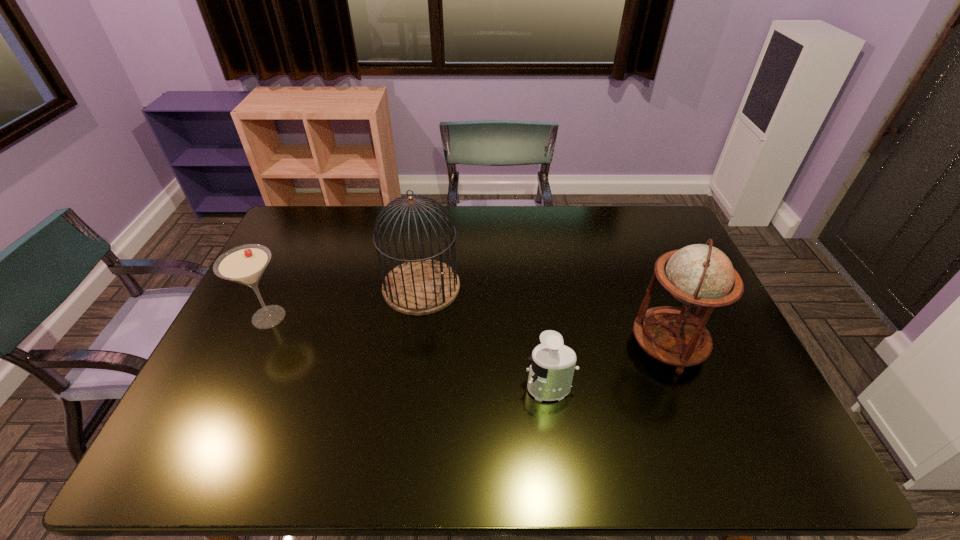
The width and height of the screenshot is (960, 540). Identify the location of vacant space that's between the leftmost object and the juicer. (409, 353).

Where is `vacant space that is in between the rightmost object and the shortest object`? vacant space that is in between the rightmost object and the shortest object is located at coordinates (609, 367).

You are a GUI agent. You are given a task and a screenshot of the screen. Output one action in this format:
    pyautogui.click(x=<x>, y=<y>)
    Task: Click on the vacant space that is in between the martini and the second object from right to left
    
    Given the screenshot: What is the action you would take?
    pyautogui.click(x=409, y=353)

What are the coordinates of `vacant area that lies between the martini and the third object from left to right` in the screenshot? It's located at (409, 353).

Identify the location of free space between the shortest object and the birdcage. (485, 338).

Identify the location of vacant area that lies between the third object from left to right and the rightmost object. Image resolution: width=960 pixels, height=540 pixels. (609, 367).

At what (x,y) coordinates should I click in order to perform the action: click on unoccupied area between the leftmost object and the birdcage. Please return your answer as a coordinate pair (x, y). This screenshot has width=960, height=540. Looking at the image, I should click on (345, 302).

At what (x,y) coordinates should I click in order to perform the action: click on empty space that is in between the third object from right to left and the juicer. Please return your answer as a coordinate pair (x, y). Image resolution: width=960 pixels, height=540 pixels. Looking at the image, I should click on (485, 338).

Find the location of a particular element. free space that is in between the rightmost object and the second object from right to left is located at coordinates (609, 367).

Locate an element on the screen. The image size is (960, 540). object that can be found as the second closest to the third object from right to left is located at coordinates (552, 367).